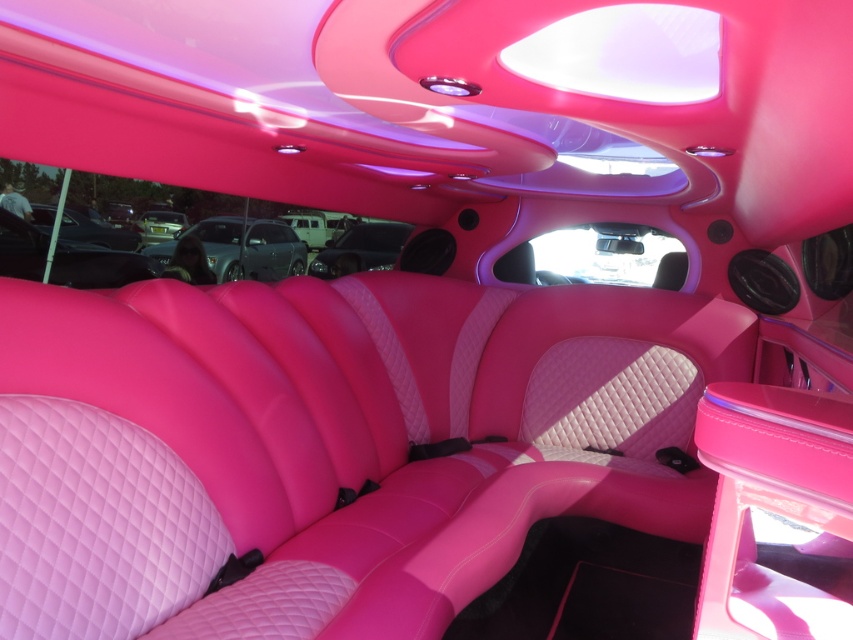
Describe the element at coordinates (248, 248) in the screenshot. I see `matte pink leather car at center` at that location.

The height and width of the screenshot is (640, 853). I want to click on matte pink leather car at center, so click(x=248, y=248).